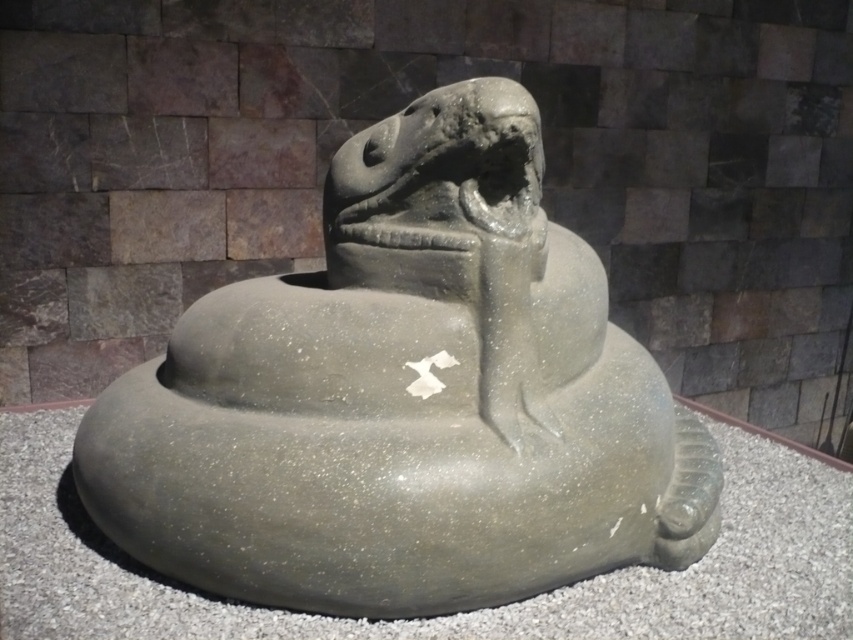
You are an art conservator standing at the entrance of the room. You need to place a protective barrier around the gray stone sculpture at center. Where should you position the barrier to ensure it is directly in front of the sculpture?

The gray stone sculpture at center is located at point (405, 397), so the protective barrier should be positioned directly in front of this coordinate to ensure proper placement.

You are an art conservator examining the gray stone sculpture at center and the gray speckled stone snake at center. Which object do you need to handle with more care due to its size?

The gray stone sculpture at center is larger in size than the gray speckled stone snake at center, so it requires more careful handling due to its greater size and potential weight.

You are an art conservator assessing the placement of the gray stone sculpture at center and the gray speckled stone snake at center in a gallery. Given that the ceiling height is 3 meters, can both objects be displayed without touching the ceiling?

The gray stone sculpture at center has a greater height compared to the gray speckled stone snake at center. If the sculpture is under 3 meters in height, it can be displayed safely without touching the ceiling. However, if it exceeds 3 meters, it would hit the ceiling. The snake, being shorter, would not reach the ceiling unless the sculpture also does not.